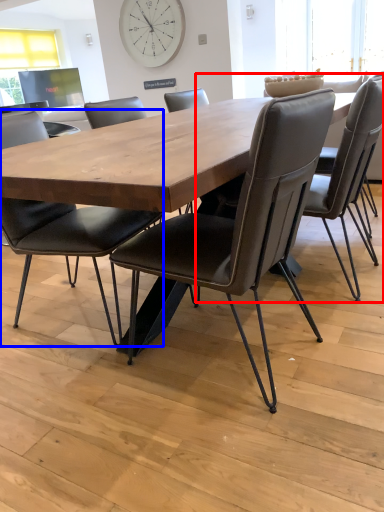
Question: Which object is further to the camera taking this photo, chair (highlighted by a red box) or chair (highlighted by a blue box)?

Choices:
 (A) chair
 (B) chair

Answer: (A)